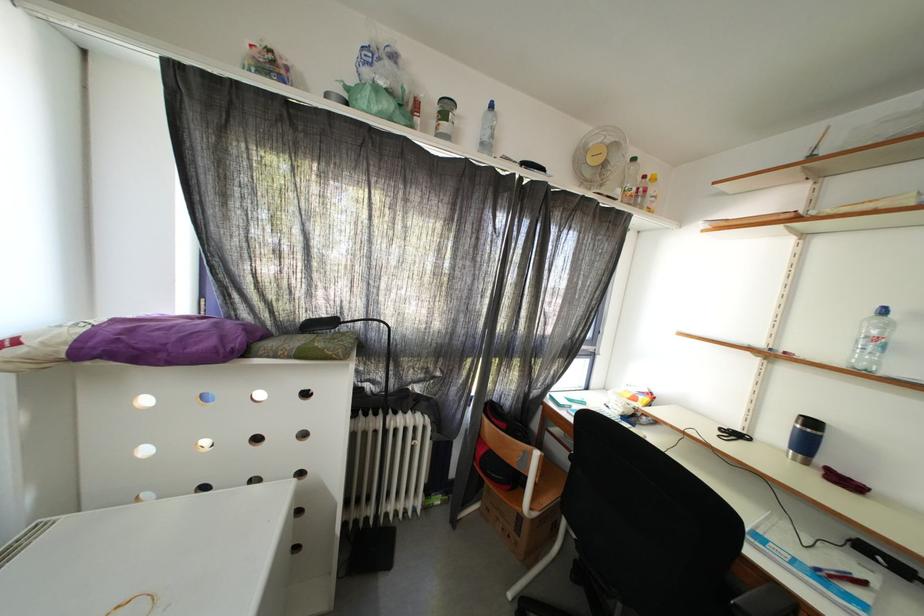
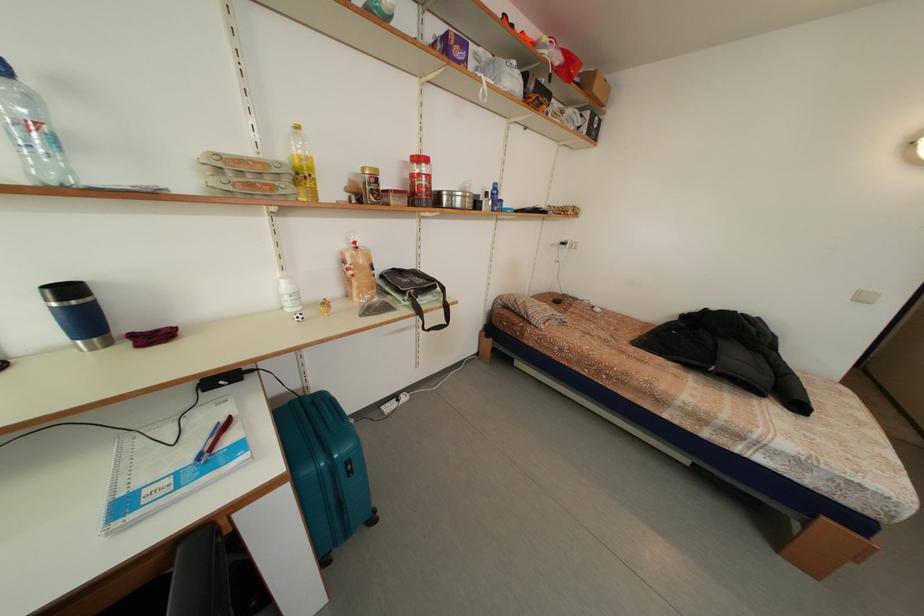
How did the camera likely rotate?

The camera rotated toward right-down.